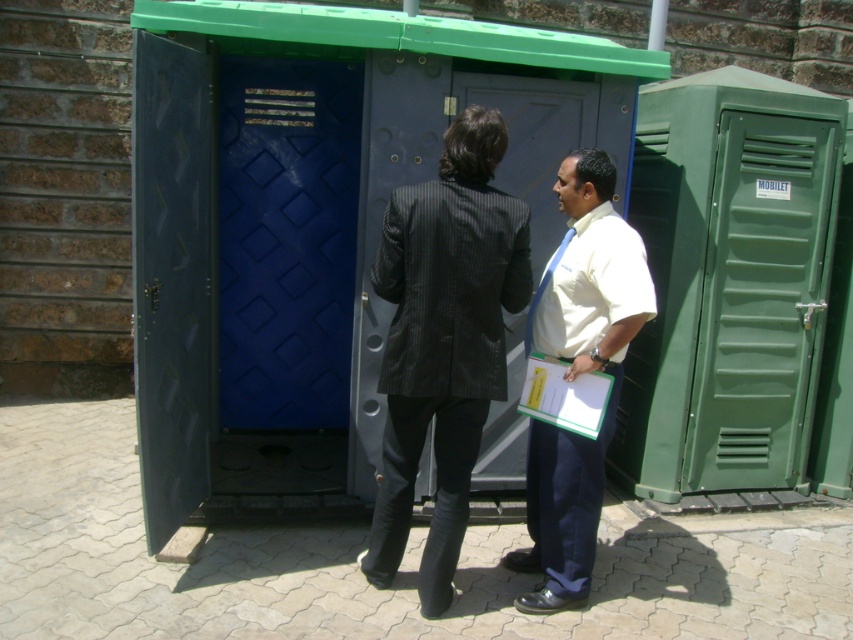
Looking at this image, which of these two, dark gray pinstripe suit at center or white shirt at center, stands taller?

dark gray pinstripe suit at center is taller.

Can you confirm if dark gray pinstripe suit at center is positioned to the right of white shirt at center?

Incorrect, dark gray pinstripe suit at center is not on the right side of white shirt at center.

Who is more distant from viewer, (434, 417) or (566, 465)?

The point (434, 417) is behind.

Where is `dark gray pinstripe suit at center`? Image resolution: width=853 pixels, height=640 pixels. dark gray pinstripe suit at center is located at coordinates (444, 340).

Is point (701, 461) closer to camera compared to point (584, 342)?

No, (701, 461) is further to viewer.

Between green plastic door at right and white shirt at center, which one appears on the right side from the viewer's perspective?

From the viewer's perspective, green plastic door at right appears more on the right side.

Where is `green plastic door at right`? green plastic door at right is located at coordinates (762, 301).

Can you confirm if dark gray pinstripe suit at center is positioned to the right of green plastic door at right?

In fact, dark gray pinstripe suit at center is to the left of green plastic door at right.

Does dark gray pinstripe suit at center have a lesser width compared to green plastic door at right?

Correct, dark gray pinstripe suit at center's width is less than green plastic door at right's.

Is point (463, 220) less distant than point (809, 358)?

Yes, point (463, 220) is in front of point (809, 358).

Identify the location of dark gray pinstripe suit at center. (444, 340).